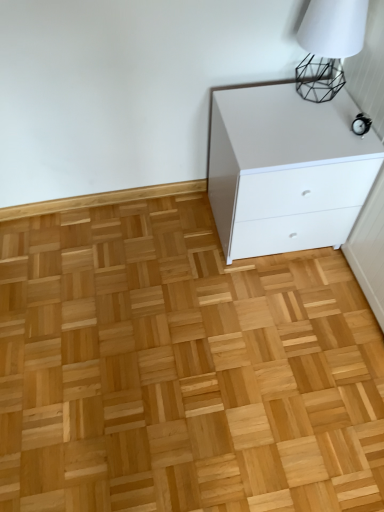
Question: From the image's perspective, is white matte table lamp at upper right located above white glossy chest of drawers at upper right?

Choices:
 (A) no
 (B) yes

Answer: (B)

Question: Is white matte table lamp at upper right wider than white glossy chest of drawers at upper right?

Choices:
 (A) yes
 (B) no

Answer: (B)

Question: Is white matte table lamp at upper right thinner than white glossy chest of drawers at upper right?

Choices:
 (A) no
 (B) yes

Answer: (B)

Question: Can you confirm if white matte table lamp at upper right is shorter than white glossy chest of drawers at upper right?

Choices:
 (A) yes
 (B) no

Answer: (A)

Question: Could you tell me if white matte table lamp at upper right is facing white glossy chest of drawers at upper right?

Choices:
 (A) yes
 (B) no

Answer: (B)

Question: From a real-world perspective, relative to natural wood floor at center, is white glossy chest of drawers at upper right vertically above or below?

Choices:
 (A) above
 (B) below

Answer: (A)

Question: Considering their positions, is white glossy chest of drawers at upper right located in front of or behind natural wood floor at center?

Choices:
 (A) front
 (B) behind

Answer: (B)

Question: Is white glossy chest of drawers at upper right situated inside natural wood floor at center or outside?

Choices:
 (A) inside
 (B) outside

Answer: (B)

Question: Is white glossy chest of drawers at upper right bigger or smaller than natural wood floor at center?

Choices:
 (A) small
 (B) big

Answer: (B)

Question: From a real-world perspective, relative to white glossy chest of drawers at upper right, is white matte table lamp at upper right vertically above or below?

Choices:
 (A) below
 (B) above

Answer: (B)

Question: Looking at the image, does white matte table lamp at upper right seem bigger or smaller compared to white glossy chest of drawers at upper right?

Choices:
 (A) big
 (B) small

Answer: (B)

Question: Considering their positions, is white matte table lamp at upper right located in front of or behind white glossy chest of drawers at upper right?

Choices:
 (A) front
 (B) behind

Answer: (A)

Question: Does point (309, 98) appear closer or farther from the camera than point (266, 96)?

Choices:
 (A) closer
 (B) farther

Answer: (A)

Question: Do you think white glossy chest of drawers at upper right is within white matte table lamp at upper right, or outside of it?

Choices:
 (A) inside
 (B) outside

Answer: (B)

Question: Based on their positions, is white glossy chest of drawers at upper right located to the left or right of white matte table lamp at upper right?

Choices:
 (A) left
 (B) right

Answer: (A)